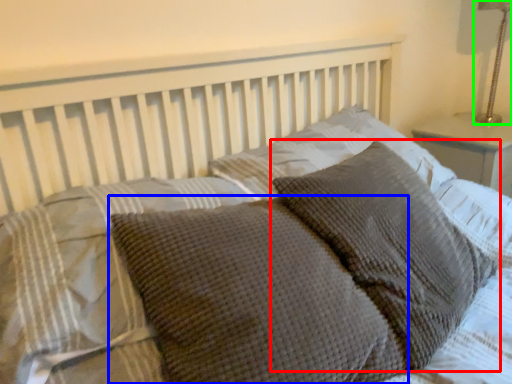
Question: Which is farther away from pillow (highlighted by a red box)? pillow (highlighted by a blue box) or bedside lamp (highlighted by a green box)?

Choices:
 (A) pillow
 (B) bedside lamp

Answer: (B)